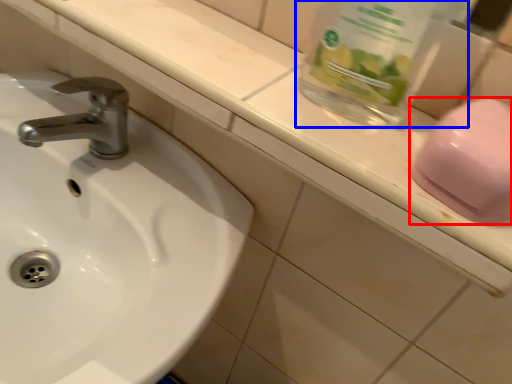
Question: Which of the following is the closest to the observer, soap (highlighted by a red box) or glass jar (highlighted by a blue box)?

Choices:
 (A) soap
 (B) glass jar

Answer: (B)